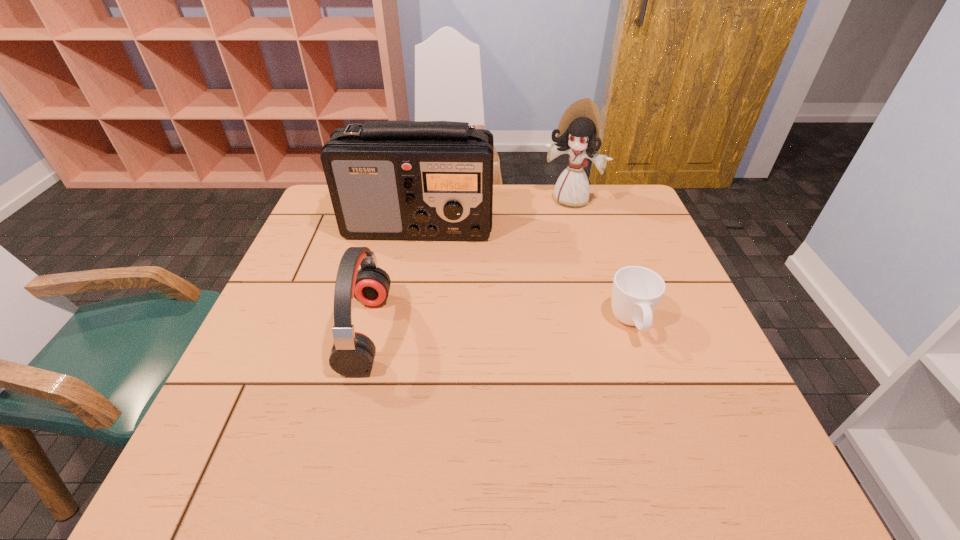
Identify the location of free spot located at the front face of the doll. (536, 247).

The image size is (960, 540). In order to click on free space located at the front face of the doll in this screenshot , I will do `click(510, 283)`.

The height and width of the screenshot is (540, 960). Identify the location of radio receiver that is at the far edge. (413, 180).

Where is `doll at the far edge`? This screenshot has width=960, height=540. doll at the far edge is located at coordinates (578, 131).

Where is `object at the left edge`? This screenshot has height=540, width=960. object at the left edge is located at coordinates (413, 180).

Where is `cup present at the right edge`? Image resolution: width=960 pixels, height=540 pixels. cup present at the right edge is located at coordinates pyautogui.click(x=636, y=292).

The height and width of the screenshot is (540, 960). I want to click on doll that is at the right edge, so click(x=578, y=131).

Where is `object located at the far left corner`? This screenshot has width=960, height=540. object located at the far left corner is located at coordinates (413, 180).

Image resolution: width=960 pixels, height=540 pixels. I want to click on object that is at the far right corner, so click(x=578, y=131).

Find the location of `vacant space at the far edge of the desktop`. vacant space at the far edge of the desktop is located at coordinates (538, 198).